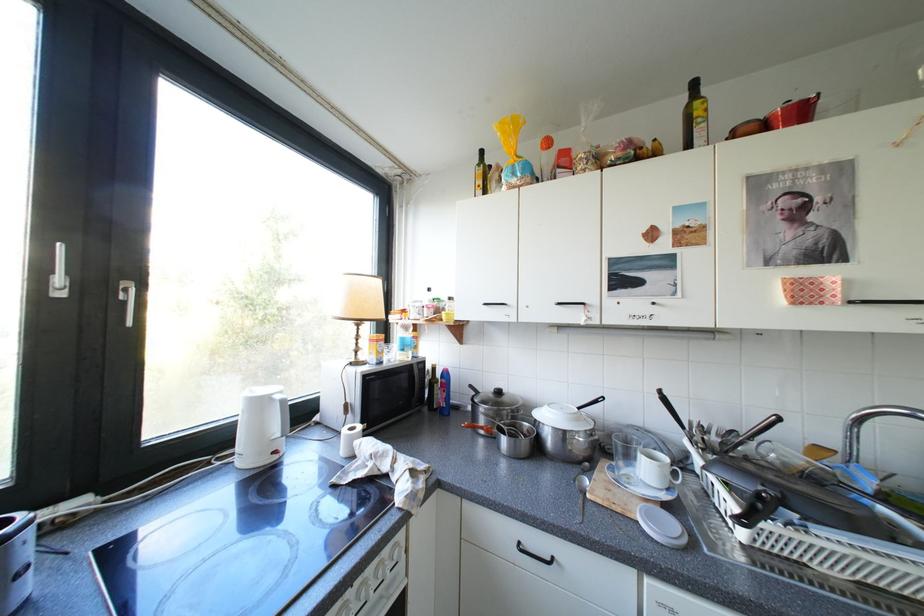
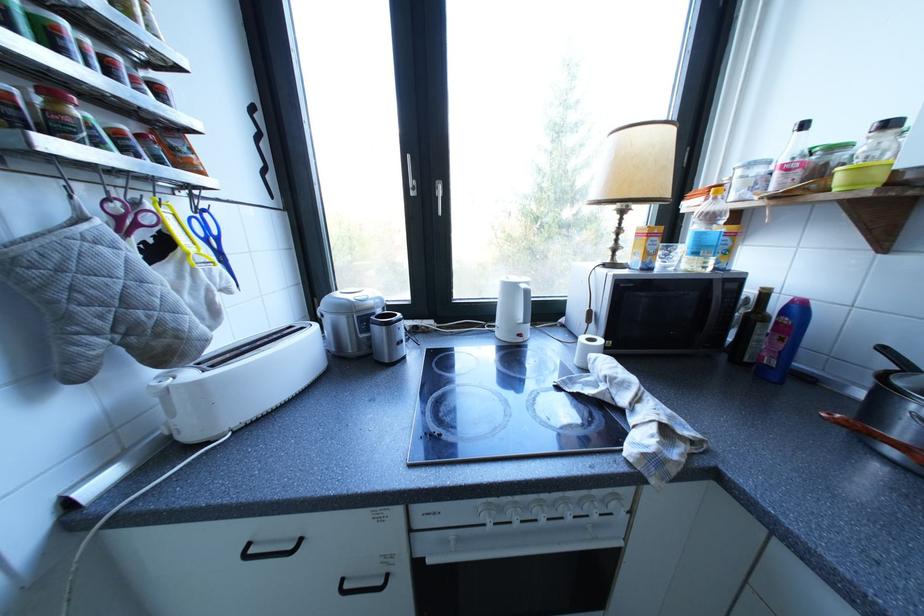
The point at (494, 431) is marked in the first image. Where is the corresponding point in the second image?

(907, 454)